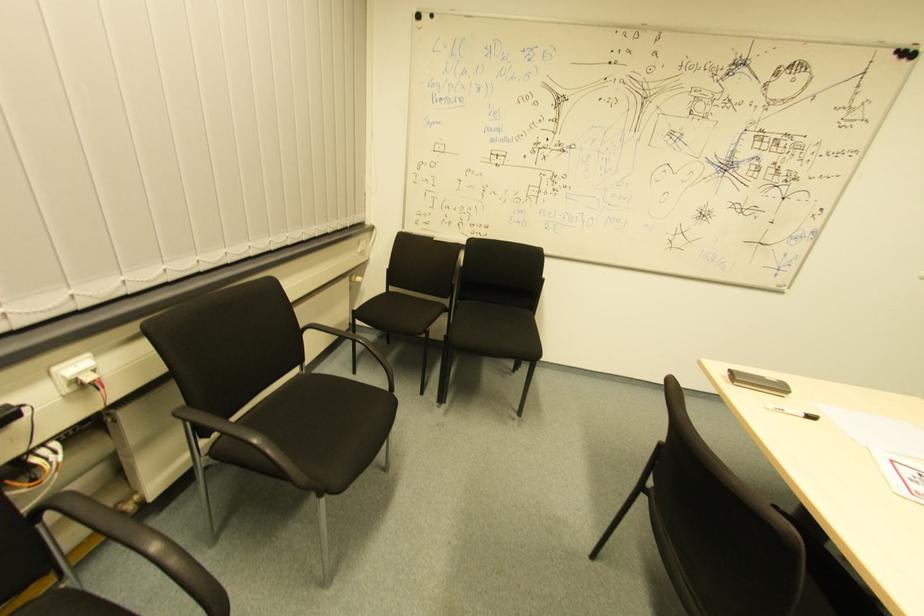
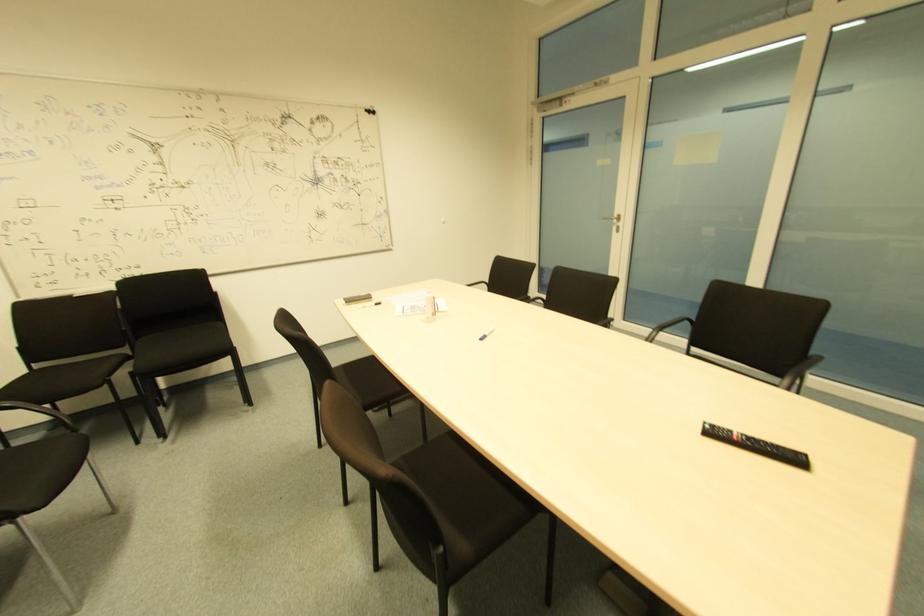
Question: The images are taken continuously from a first-person perspective. In which direction is your viewpoint rotating?

Choices:
 (A) Left
 (B) Right
 (C) Up
 (D) Down

Answer: (B)